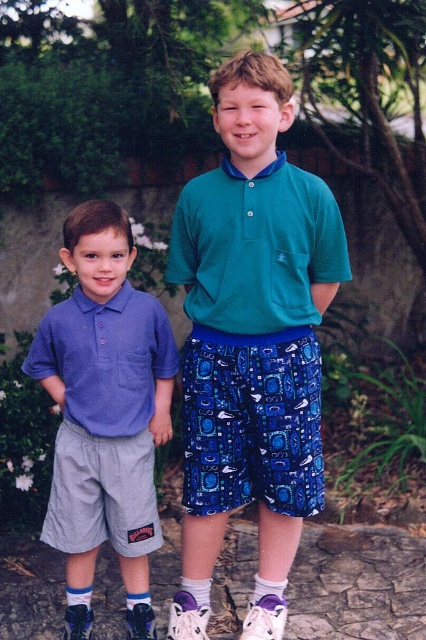
You are a delivery robot with a package that needs to be placed between the gray stone at lower center and the green matte polo shirt at center. The package requires a minimum of 1.5 meters of space to be safely placed. Based on the image, can you determine if there is enough space between them?

The distance between the gray stone at lower center and the green matte polo shirt at center is 1.34 meters, which is less than the required 1.5 meters. Therefore, there is not enough space to safely place the package between them.

You are trying to locate the matte blue polo shirt at center in an image. Based on the coordinates provided, where exactly should you look within the frame?

The matte blue polo shirt at center is located at point coordinates 0.561 on the x axis and 0.249 on the y axis.